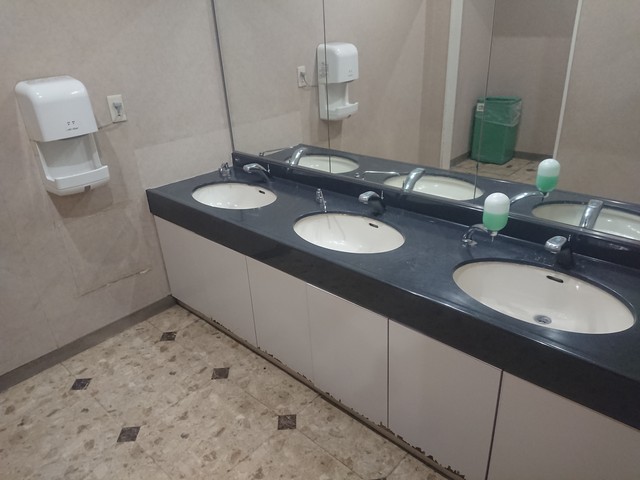
The width and height of the screenshot is (640, 480). Find the location of `faucet`. faucet is located at coordinates (365, 197).